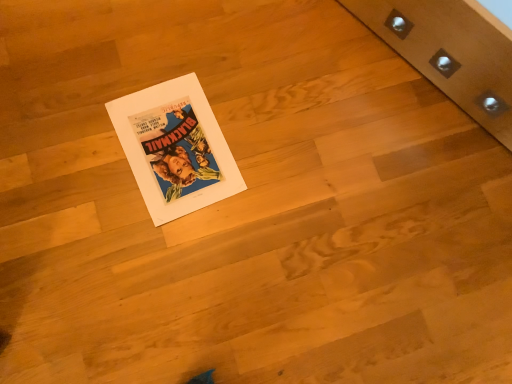
Where is `matte paper poster at center`? matte paper poster at center is located at coordinates [x=175, y=148].

Describe the element at coordinates (175, 148) in the screenshot. I see `matte paper poster at center` at that location.

Where is `matte paper poster at center`? matte paper poster at center is located at coordinates (175, 148).